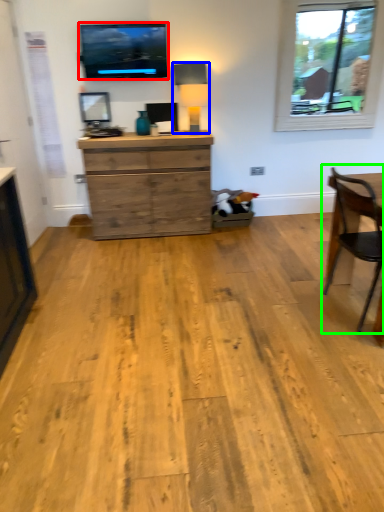
Question: Which object is positioned closest to television (highlighted by a red box)? Select from lamp (highlighted by a blue box) and chair (highlighted by a green box).

Choices:
 (A) lamp
 (B) chair

Answer: (A)